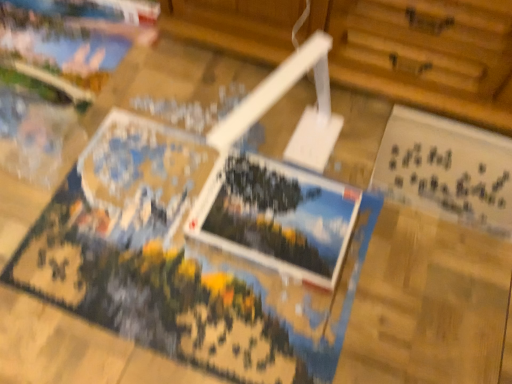
Question: Is white paper postcard at lower right, the 1th postcard in the right-to-left sequence, in front of or behind printed paper postcard at center, positioned as the first postcard in left-to-right order, in the image?

Choices:
 (A) front
 (B) behind

Answer: (B)

Question: Considering the positions of white paper postcard at lower right, the 1th postcard in the right-to-left sequence, and printed paper postcard at center, positioned as the first postcard in left-to-right order, in the image, is white paper postcard at lower right, the 1th postcard in the right-to-left sequence, taller or shorter than printed paper postcard at center, positioned as the first postcard in left-to-right order,?

Choices:
 (A) tall
 (B) short

Answer: (A)

Question: Based on their positions, is white paper postcard at lower right, the 1th postcard in the right-to-left sequence, located to the left or right of printed paper postcard at center, positioned as the first postcard in left-to-right order?

Choices:
 (A) left
 (B) right

Answer: (B)

Question: Is point (297, 213) closer or farther from the camera than point (409, 185)?

Choices:
 (A) farther
 (B) closer

Answer: (B)

Question: Is printed paper postcard at center, positioned as the first postcard in left-to-right order, bigger or smaller than white paper postcard at lower right, the 2th postcard from the left?

Choices:
 (A) small
 (B) big

Answer: (A)

Question: In the image, is printed paper postcard at center, positioned as the first postcard in left-to-right order, positioned in front of or behind white paper postcard at lower right, the 2th postcard from the left?

Choices:
 (A) behind
 (B) front

Answer: (B)

Question: From a real-world perspective, is printed paper postcard at center, positioned as the first postcard in left-to-right order, physically located above or below white paper postcard at lower right, the 2th postcard from the left?

Choices:
 (A) above
 (B) below

Answer: (A)